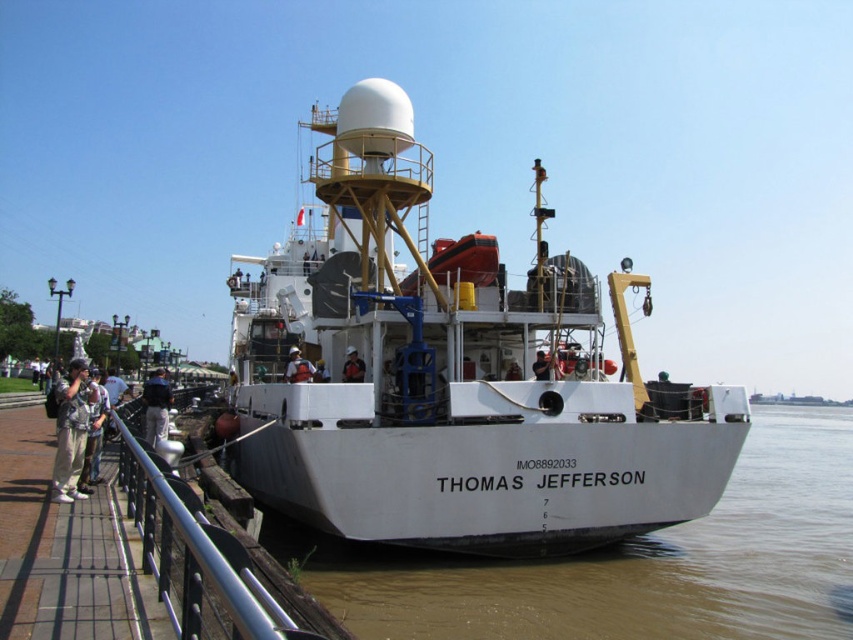
You are standing on the deck of the Thomas Jefferson and want to place a new safety sign between the silver metallic railing at lower left and the white matte helmet at center. Which object should the sign be placed closer to if it needs to be nearer to the viewer?

The safety sign should be placed closer to the silver metallic railing at lower left because it is closer to the viewer than the white matte helmet at center.